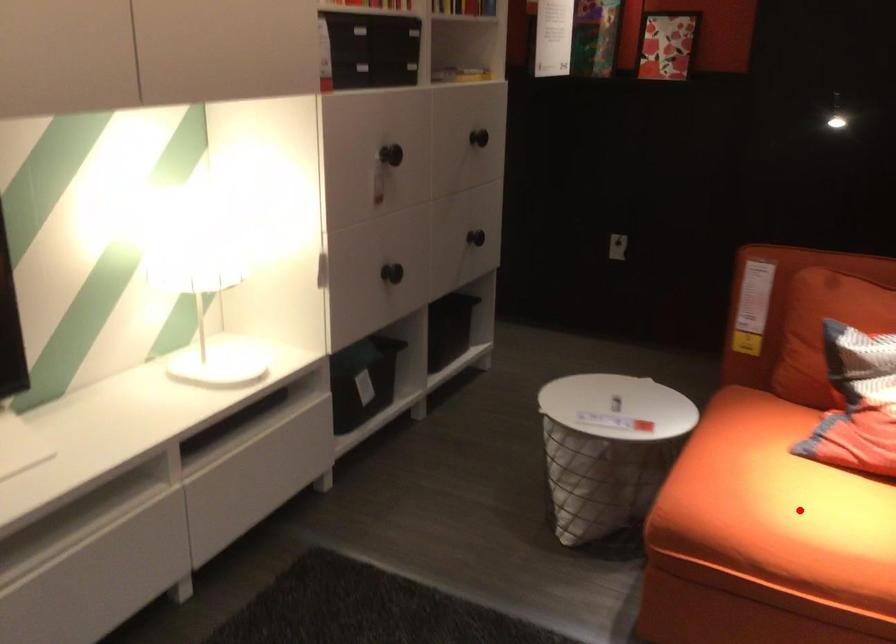
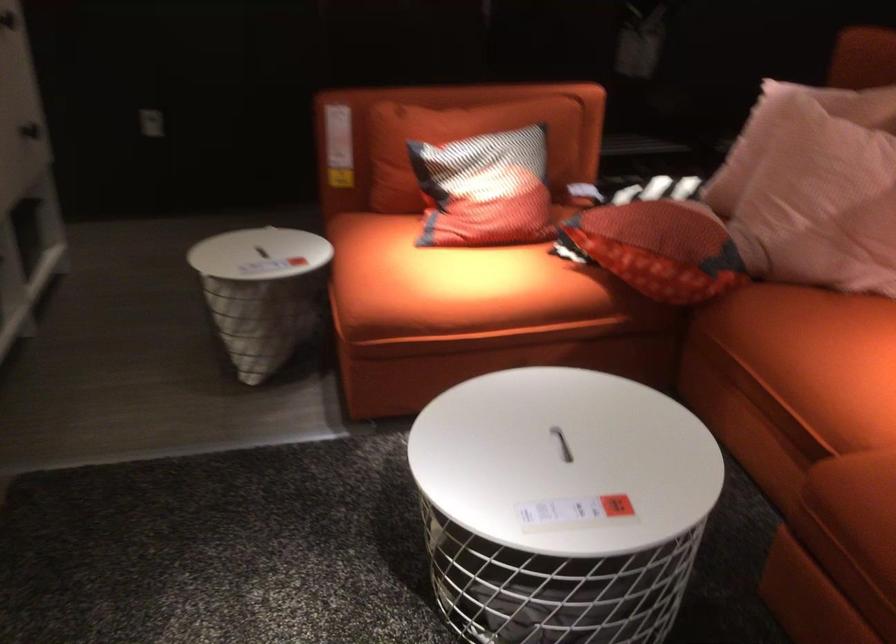
Locate, in the second image, the point that corresponds to the highlighted location in the first image.

(449, 281)